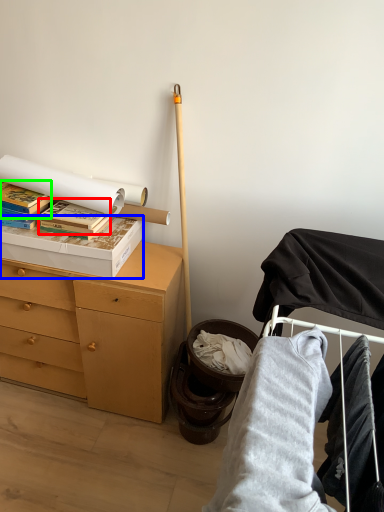
Question: Based on their relative distances, which object is nearer to paperback book (highlighted by a red box)? Choose from box (highlighted by a blue box) and paperback book (highlighted by a green box).

Choices:
 (A) box
 (B) paperback book

Answer: (A)